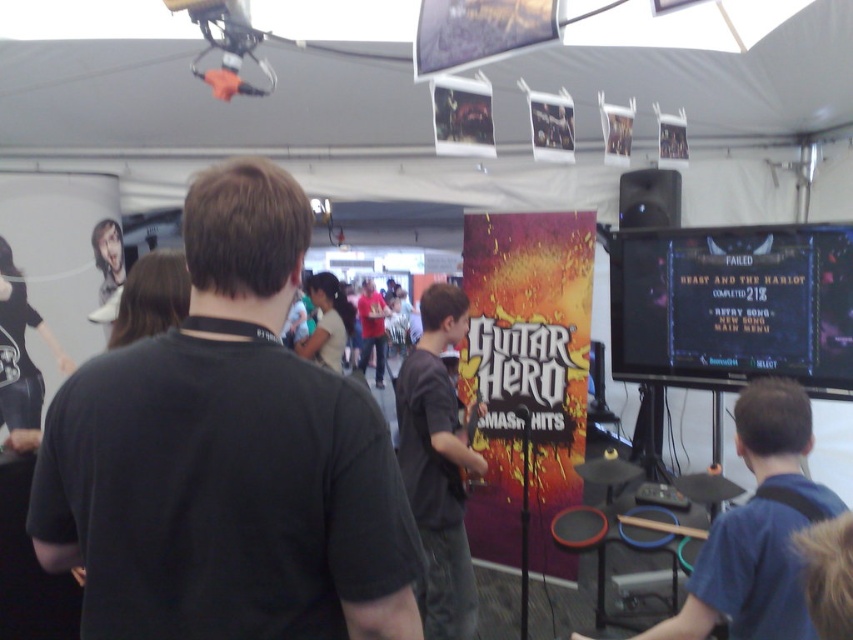
You are a photographer at the gaming event and want to capture both the blue fabric shirt at center and the dark gray shirt at center in a single shot. Since you want both shirts to be clearly visible, which shirt should you focus on to ensure the smaller one is in sharp focus?

The blue fabric shirt at center is smaller than the dark gray shirt at center, so you should focus on the blue fabric shirt at center to ensure it is in sharp focus.